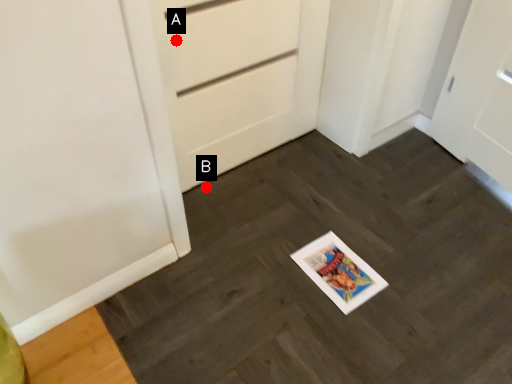
Question: Two points are circled on the image, labeled by A and B beside each circle. Which point is farther from the camera taking this photo?

Choices:
 (A) A is further
 (B) B is further

Answer: (B)